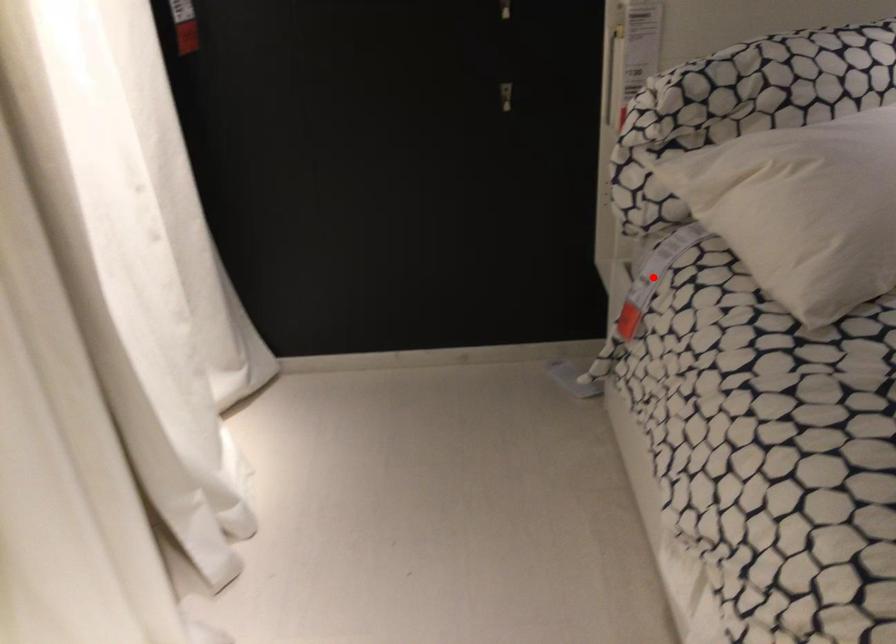
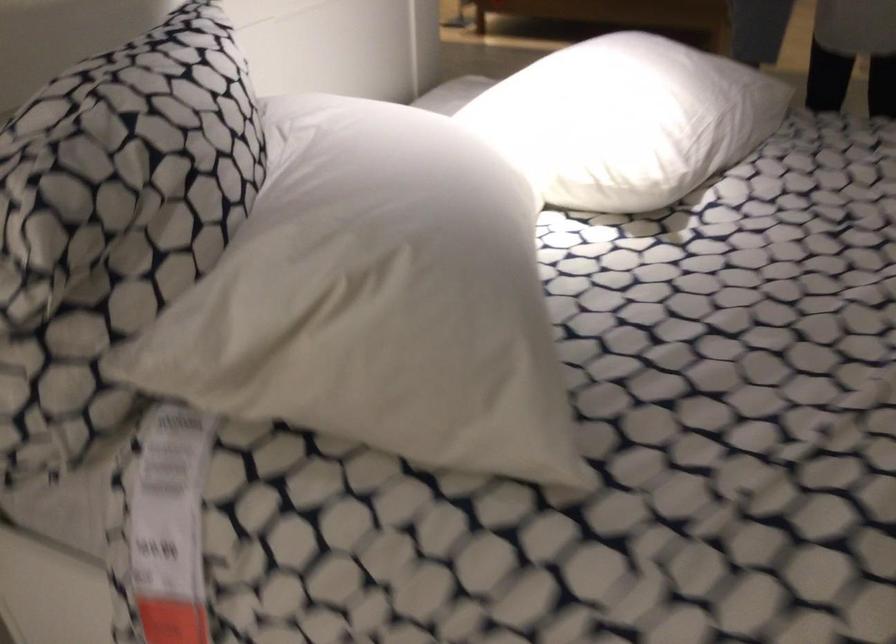
Question: I am providing you with two images of the same scene from different viewpoints. Image1 has a red point marked. In image2, the corresponding 3D location appears at what relative position? Reply with the corresponding letter.

Choices:
 (A) Closer
 (B) Farther

Answer: (A)